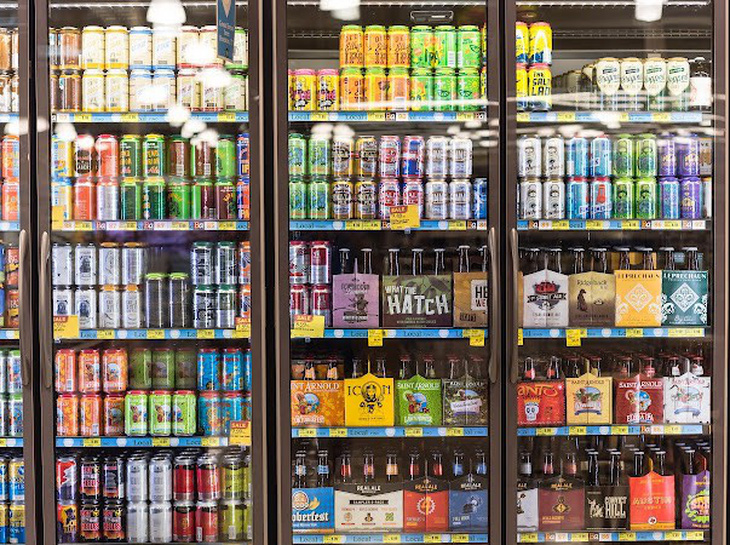
You are a GUI agent. You are given a task and a screenshot of the screen. Output one action in this format:
    pyautogui.click(x=<x>, y=<y>)
    Task: Click on the cooler door handles
    
    Given the screenshot: What is the action you would take?
    pyautogui.click(x=23, y=293), pyautogui.click(x=46, y=293), pyautogui.click(x=491, y=296), pyautogui.click(x=507, y=296)